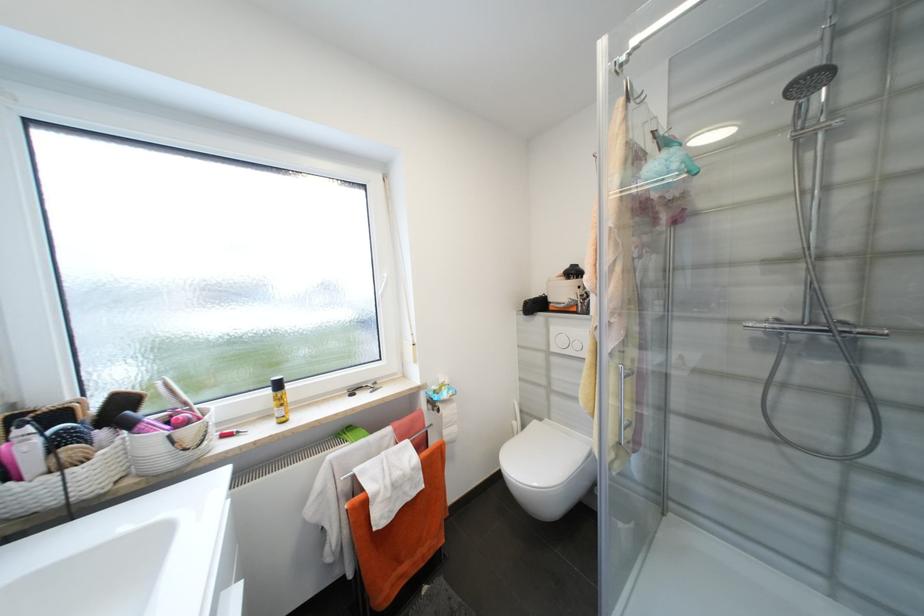
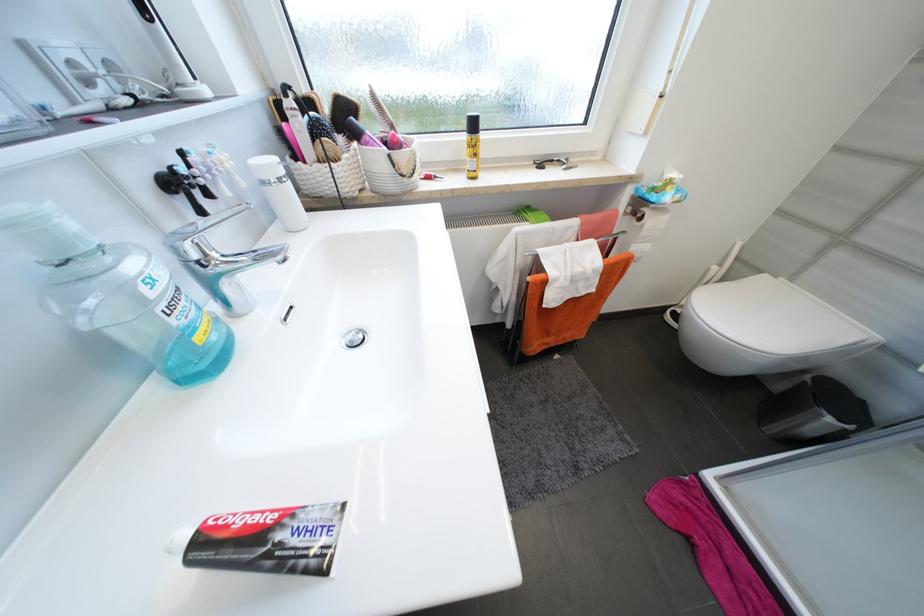
Where in the second image is the point corresponding to [285,413] from the first image?

(477, 166)